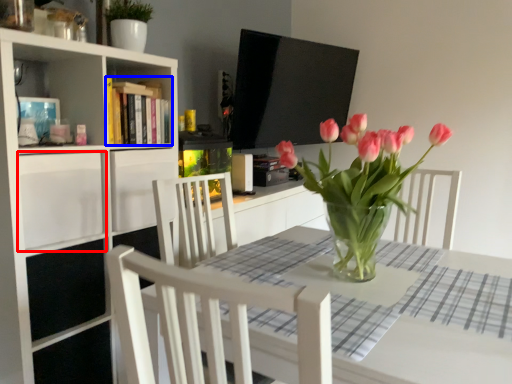
Question: Which object is further to the camera taking this photo, drawer (highlighted by a red box) or book (highlighted by a blue box)?

Choices:
 (A) drawer
 (B) book

Answer: (B)